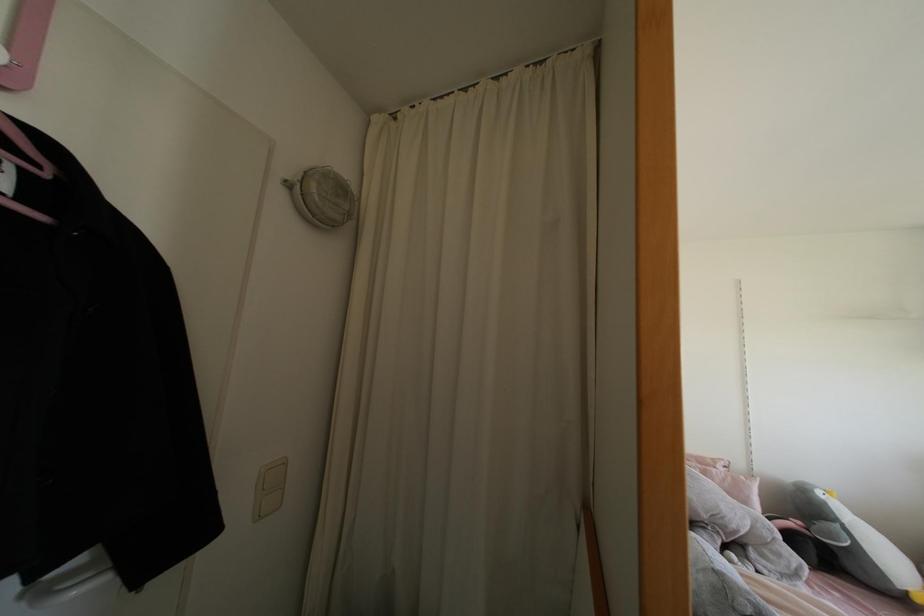
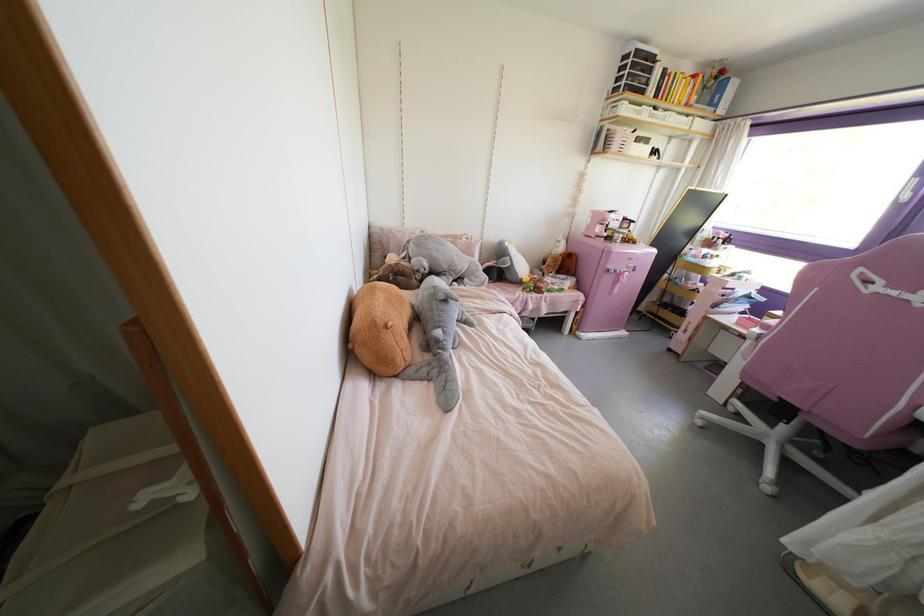
Where in the second image is the point corresponding to the point at 796,575 from the first image?

(482, 284)